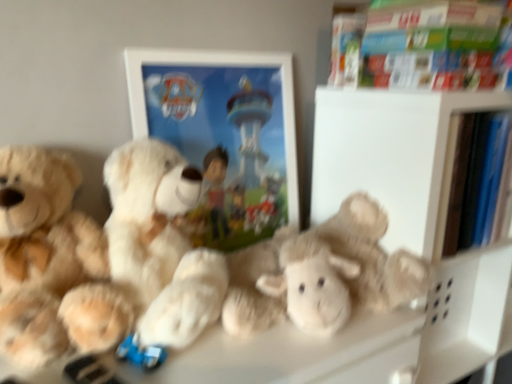
What do you see at coordinates (161, 243) in the screenshot? I see `fluffy white teddy bear at center, which is counted as the second teddy bear, starting from the left` at bounding box center [161, 243].

Measure the distance between point [98,232] and camera.

The depth of point [98,232] is 34.21 inches.

The height and width of the screenshot is (384, 512). I want to click on white matte picture frame at center, so click(223, 136).

I want to click on fluffy white teddy bear at center, the second teddy bear from the right, so click(x=161, y=243).

Do you think fluffy white teddy bear at center, positioned as the third teddy bear in left-to-right order, is within white matte picture frame at center, or outside of it?

fluffy white teddy bear at center, positioned as the third teddy bear in left-to-right order, cannot be found inside white matte picture frame at center.

Considering the relative sizes of fluffy white teddy bear at center, positioned as the third teddy bear in left-to-right order, and white matte picture frame at center in the image provided, is fluffy white teddy bear at center, positioned as the third teddy bear in left-to-right order, wider than white matte picture frame at center?

Yes.

From the picture: Is fluffy white teddy bear at center, which is the 1th teddy bear from right to left, far from white matte picture frame at center?

fluffy white teddy bear at center, which is the 1th teddy bear from right to left, is near white matte picture frame at center, not far away.

Looking at this image, from a real-world perspective, relative to white matte picture frame at center, is soft plush teddy bear at left, which ranks as the 3th teddy bear in right-to-left order, vertically above or below?

From a real-world perspective, soft plush teddy bear at left, which ranks as the 3th teddy bear in right-to-left order, is physically below white matte picture frame at center.

Is soft plush teddy bear at left, which ranks as the first teddy bear in left-to-right order, far away from white matte picture frame at center?

soft plush teddy bear at left, which ranks as the first teddy bear in left-to-right order, is near white matte picture frame at center, not far away.

Considering the sizes of objects soft plush teddy bear at left, which ranks as the 3th teddy bear in right-to-left order, and white matte picture frame at center in the image provided, who is shorter, soft plush teddy bear at left, which ranks as the 3th teddy bear in right-to-left order, or white matte picture frame at center?

With less height is soft plush teddy bear at left, which ranks as the 3th teddy bear in right-to-left order.

From the image's perspective, would you say soft plush teddy bear at left, which ranks as the first teddy bear in left-to-right order, is positioned over white matte picture frame at center?

Incorrect, from the image's perspective, soft plush teddy bear at left, which ranks as the first teddy bear in left-to-right order, is lower than white matte picture frame at center.

Considering the sizes of objects fluffy white teddy bear at center, positioned as the third teddy bear in left-to-right order, and soft plush teddy bear at left, which ranks as the first teddy bear in left-to-right order, in the image provided, who is bigger, fluffy white teddy bear at center, positioned as the third teddy bear in left-to-right order, or soft plush teddy bear at left, which ranks as the first teddy bear in left-to-right order,?

With larger size is fluffy white teddy bear at center, positioned as the third teddy bear in left-to-right order.

Is fluffy white teddy bear at center, which is the 1th teddy bear from right to left, to the left of soft plush teddy bear at left, which ranks as the 3th teddy bear in right-to-left order, from the viewer's perspective?

No, fluffy white teddy bear at center, which is the 1th teddy bear from right to left, is not to the left of soft plush teddy bear at left, which ranks as the 3th teddy bear in right-to-left order.

Would you say soft plush teddy bear at left, which ranks as the first teddy bear in left-to-right order, is part of fluffy white teddy bear at center, which is the 1th teddy bear from right to left,'s contents?

No, soft plush teddy bear at left, which ranks as the first teddy bear in left-to-right order, is not a part of fluffy white teddy bear at center, which is the 1th teddy bear from right to left.

From a real-world perspective, is fluffy white teddy bear at center, positioned as the third teddy bear in left-to-right order, physically located above or below soft plush teddy bear at left, which ranks as the 3th teddy bear in right-to-left order?

fluffy white teddy bear at center, positioned as the third teddy bear in left-to-right order, is situated lower than soft plush teddy bear at left, which ranks as the 3th teddy bear in right-to-left order, in the real world.

Is white matte picture frame at center inside or outside of fluffy white teddy bear at center, which is counted as the second teddy bear, starting from the left?

white matte picture frame at center is spatially situated outside fluffy white teddy bear at center, which is counted as the second teddy bear, starting from the left.

How many degrees apart are the facing directions of white matte picture frame at center and fluffy white teddy bear at center, which is counted as the second teddy bear, starting from the left?

They differ by 2.06 degrees in their facing directions.

Which is in front, white matte picture frame at center or fluffy white teddy bear at center, the second teddy bear from the right?

fluffy white teddy bear at center, the second teddy bear from the right, is closer to the camera.

From the image's perspective, between white matte picture frame at center and fluffy white teddy bear at center, the second teddy bear from the right, who is located below?

fluffy white teddy bear at center, the second teddy bear from the right, is shown below in the image.

Is fluffy white teddy bear at center, which is counted as the second teddy bear, starting from the left, placed right next to white matte picture frame at center?

fluffy white teddy bear at center, which is counted as the second teddy bear, starting from the left, and white matte picture frame at center are clearly separated.

Considering the relative sizes of fluffy white teddy bear at center, the second teddy bear from the right, and white matte picture frame at center in the image provided, is fluffy white teddy bear at center, the second teddy bear from the right, taller than white matte picture frame at center?

No, fluffy white teddy bear at center, the second teddy bear from the right, is not taller than white matte picture frame at center.

Which is nearer, (132, 158) or (207, 54)?

Point (132, 158) is closer to the camera than point (207, 54).

From a real-world perspective, is fluffy white teddy bear at center, the second teddy bear from the right, on white matte picture frame at center?

No, from a real-world perspective, fluffy white teddy bear at center, the second teddy bear from the right, is not over white matte picture frame at center

From a real-world perspective, is fluffy white teddy bear at center, which is counted as the second teddy bear, starting from the left, located beneath soft plush teddy bear at left, which ranks as the 3th teddy bear in right-to-left order?

Incorrect, from a real-world perspective, fluffy white teddy bear at center, which is counted as the second teddy bear, starting from the left, is higher than soft plush teddy bear at left, which ranks as the 3th teddy bear in right-to-left order.

Is fluffy white teddy bear at center, which is counted as the second teddy bear, starting from the left, bigger than soft plush teddy bear at left, which ranks as the 3th teddy bear in right-to-left order?

Yes.

Can you tell me how much fluffy white teddy bear at center, the second teddy bear from the right, and soft plush teddy bear at left, which ranks as the first teddy bear in left-to-right order, differ in facing direction?

The angle between the facing direction of fluffy white teddy bear at center, the second teddy bear from the right, and the facing direction of soft plush teddy bear at left, which ranks as the first teddy bear in left-to-right order, is 0.893 degrees.

Could soft plush teddy bear at left, which ranks as the 3th teddy bear in right-to-left order, be considered to be inside fluffy white teddy bear at center, the second teddy bear from the right?

No, soft plush teddy bear at left, which ranks as the 3th teddy bear in right-to-left order, is not inside fluffy white teddy bear at center, the second teddy bear from the right.

Is hardcover book at upper right oriented away from fluffy white teddy bear at center, the second teddy bear from the right?

That's not correct — hardcover book at upper right is not looking away from fluffy white teddy bear at center, the second teddy bear from the right.

From their relative heights in the image, would you say hardcover book at upper right is taller or shorter than fluffy white teddy bear at center, which is counted as the second teddy bear, starting from the left?

Clearly, hardcover book at upper right is shorter compared to fluffy white teddy bear at center, which is counted as the second teddy bear, starting from the left.

Considering the positions of objects hardcover book at upper right and fluffy white teddy bear at center, which is counted as the second teddy bear, starting from the left, in the image provided, who is more to the right, hardcover book at upper right or fluffy white teddy bear at center, which is counted as the second teddy bear, starting from the left,?

hardcover book at upper right is more to the right.

Identify the location of picture frame above the fluffy white teddy bear at center, which is the 1th teddy bear from right to left (from a real-world perspective). Image resolution: width=512 pixels, height=384 pixels. (223, 136).

There is a white matte picture frame at center. Identify the location of the 2nd teddy bear below it (from the image's perspective). The height and width of the screenshot is (384, 512). (42, 251).

From the image, which object appears to be farther from fluffy white teddy bear at center, positioned as the third teddy bear in left-to-right order, soft plush teddy bear at left, which ranks as the first teddy bear in left-to-right order, or white matte picture frame at center?

Based on the image, white matte picture frame at center appears to be further to fluffy white teddy bear at center, positioned as the third teddy bear in left-to-right order.

Considering their positions, is fluffy white teddy bear at center, the second teddy bear from the right, positioned closer to hardcover book at upper right than fluffy white teddy bear at center, which is the 1th teddy bear from right to left?

fluffy white teddy bear at center, which is the 1th teddy bear from right to left, is closer to hardcover book at upper right.

Which object lies nearer to the anchor point hardcover book at upper right, fluffy white teddy bear at center, positioned as the third teddy bear in left-to-right order, or soft plush teddy bear at left, which ranks as the 3th teddy bear in right-to-left order?

The object closer to hardcover book at upper right is fluffy white teddy bear at center, positioned as the third teddy bear in left-to-right order.

Estimate the real-world distances between objects in this image. Which object is closer to white matte picture frame at center, hardcover book at upper right or soft plush teddy bear at left, which ranks as the first teddy bear in left-to-right order?

Among the two, hardcover book at upper right is located nearer to white matte picture frame at center.

Based on their spatial positions, is fluffy white teddy bear at center, positioned as the third teddy bear in left-to-right order, or soft plush teddy bear at left, which ranks as the first teddy bear in left-to-right order, closer to white matte picture frame at center?

fluffy white teddy bear at center, positioned as the third teddy bear in left-to-right order, lies closer to white matte picture frame at center than the other object.

Considering their positions, is fluffy white teddy bear at center, positioned as the third teddy bear in left-to-right order, positioned closer to soft plush teddy bear at left, which ranks as the 3th teddy bear in right-to-left order, than hardcover book at upper right?

Based on the image, fluffy white teddy bear at center, positioned as the third teddy bear in left-to-right order, appears to be nearer to soft plush teddy bear at left, which ranks as the 3th teddy bear in right-to-left order.

Estimate the real-world distances between objects in this image. Which object is closer to fluffy white teddy bear at center, positioned as the third teddy bear in left-to-right order, soft plush teddy bear at left, which ranks as the first teddy bear in left-to-right order, or fluffy white teddy bear at center, which is counted as the second teddy bear, starting from the left?

fluffy white teddy bear at center, which is counted as the second teddy bear, starting from the left.

Considering their positions, is fluffy white teddy bear at center, the second teddy bear from the right, positioned closer to white matte picture frame at center than soft plush teddy bear at left, which ranks as the first teddy bear in left-to-right order?

Based on the image, fluffy white teddy bear at center, the second teddy bear from the right, appears to be nearer to white matte picture frame at center.

I want to click on picture frame between hardcover book at upper right and fluffy white teddy bear at center, which is the 1th teddy bear from right to left, in the vertical direction, so click(x=223, y=136).

The image size is (512, 384). I want to click on picture frame between soft plush teddy bear at left, which ranks as the 3th teddy bear in right-to-left order, and hardcover book at upper right, in the horizontal direction, so click(x=223, y=136).

Find the location of a particular element. teddy bear between fluffy white teddy bear at center, the second teddy bear from the right, and white matte picture frame at center, along the z-axis is located at coordinates (195, 269).

In order to click on picture frame between fluffy white teddy bear at center, which is counted as the second teddy bear, starting from the left, and hardcover book at upper right in this screenshot , I will do 223,136.